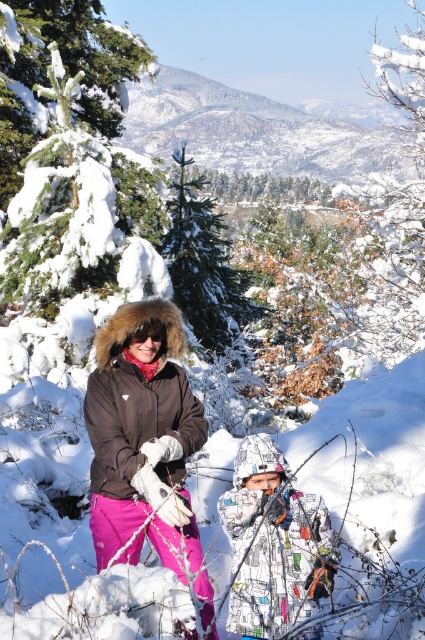
Question: Is printed fabric snowsuit at center smaller than matte black goggles at center?

Choices:
 (A) yes
 (B) no

Answer: (B)

Question: Can you confirm if matte brown jacket at center is wider than matte black goggles at center?

Choices:
 (A) no
 (B) yes

Answer: (B)

Question: Observing the image, what is the correct spatial positioning of green textured pine tree at center in reference to matte black goggles at center?

Choices:
 (A) right
 (B) left

Answer: (A)

Question: Which object appears farthest from the camera in this image?

Choices:
 (A) matte black goggles at center
 (B) green textured pine tree at center

Answer: (B)

Question: Among these objects, which one is nearest to the camera?

Choices:
 (A) matte black goggles at center
 (B) green textured pine tree at center
 (C) printed fabric snowsuit at center
 (D) snow-covered evergreen tree at center

Answer: (C)

Question: Which point is closer to the camera taking this photo?

Choices:
 (A) (127, 342)
 (B) (268, 440)
 (C) (227, 304)
 (D) (158, 305)

Answer: (A)